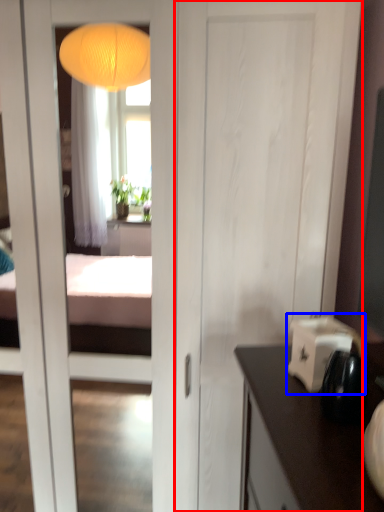
Question: Which of the following is the farthest to the observer, door (highlighted by a red box) or appliance (highlighted by a blue box)?

Choices:
 (A) door
 (B) appliance

Answer: (A)